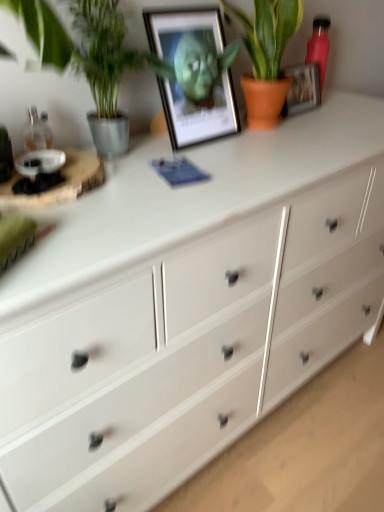
At what (x,y) coordinates should I click in order to perform the action: click on vacant space in front of metallic framed picture at upper center. Please return your answer as a coordinate pair (x, y). The image size is (384, 512). Looking at the image, I should click on (220, 164).